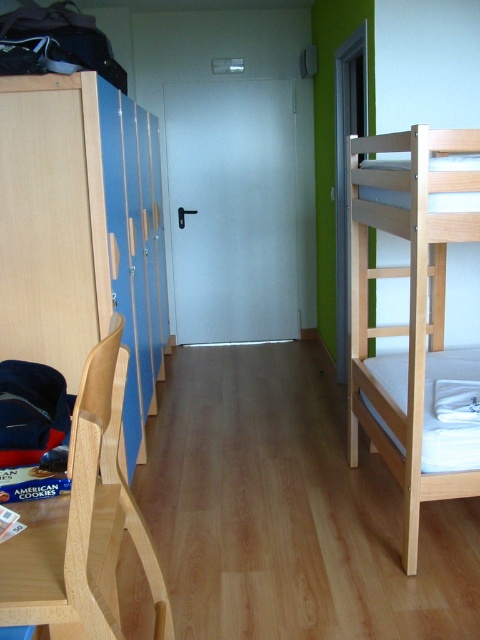
You are standing in the room and want to place a 2.5 feet wide package on the floor between the blue matte locker at left and the desk. Is there enough space for the package to fit without overlapping either the locker or the desk?

The distance between the blue matte locker at left and the camera is 7.18 feet, but the required information about the distance between the locker and the desk is not provided in the Objects Description. Therefore, it is impossible to determine if the package will fit without overlapping either the locker or the desk.

You are standing in the center of the room and want to place a new poster on the wall behind the natural wood bunk bed at right. Which direction should you walk to reach the wall behind it?

You should walk to the right to reach the wall behind the natural wood bunk bed at right since it is located on the right side of the room.